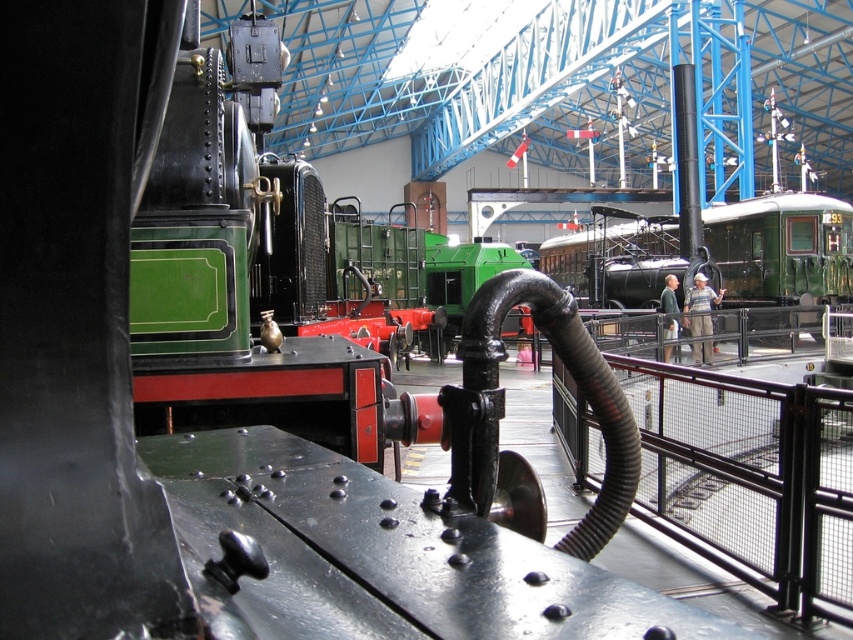
You are a museum curator planning to place a new exhibit sign between the black metal rail at center and the green polished wood train at center. The sign requires a space of 1.2 meters in width. Can you determine if there is enough space between them based on their widths?

The black metal rail at center has a lesser width compared to green polished wood train at center. However, the exact widths of both objects are not provided, so it is impossible to determine if the 1.2 meter space requirement can be met. Additional measurements are needed.

You are a maintenance worker in the museum and need to inspect the black metal rail at center and the green polished wood train at center. If your inspection tool has a 15 meter range, can you reach both objects from your current position without moving?

The black metal rail at center is 15.53 meters away from the green polished wood train at center. Since the distance between them exceeds the 15 meter range of your tool, you cannot inspect both objects without moving.